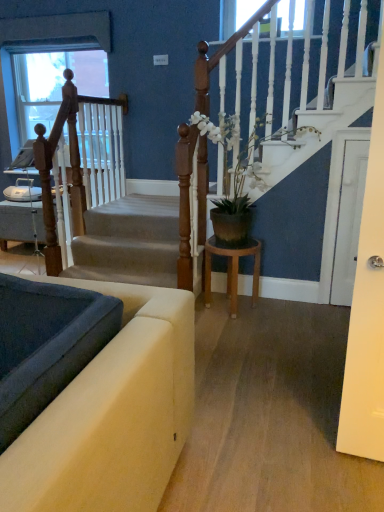
I want to click on vacant space that's between wooden stool at center and white glossy door at right, so click(x=291, y=309).